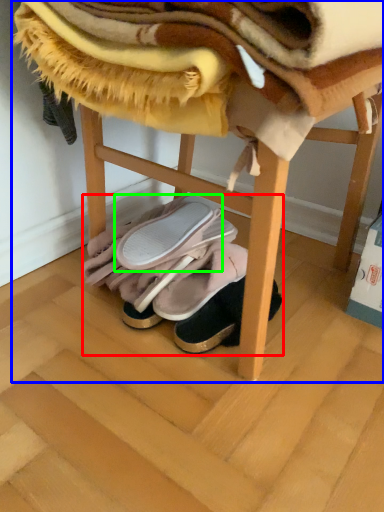
Question: Based on their relative distances, which object is nearer to footwear (highlighted by a red box)? Choose from furniture (highlighted by a blue box) and footwear (highlighted by a green box).

Choices:
 (A) furniture
 (B) footwear

Answer: (B)